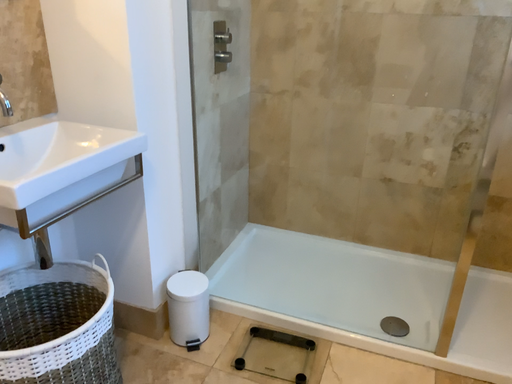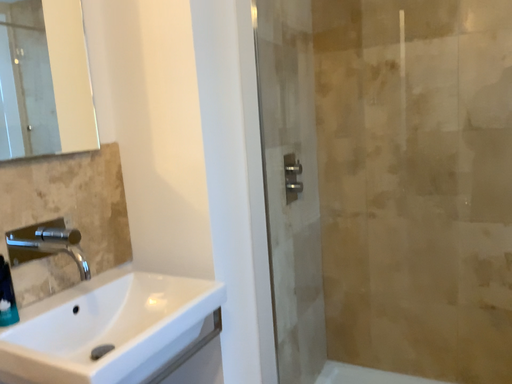
Question: How did the camera likely rotate when shooting the video?

Choices:
 (A) rotated right
 (B) rotated left

Answer: (B)